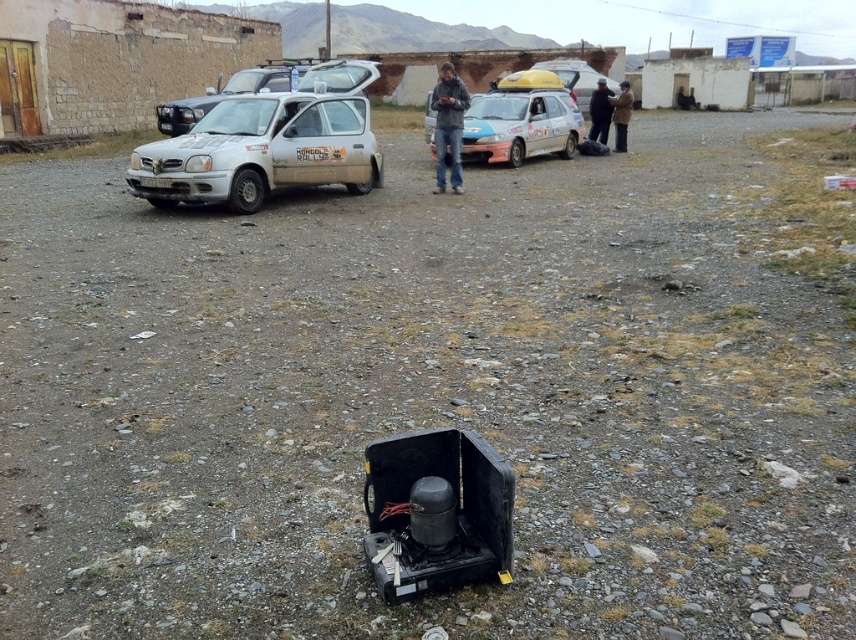
Is gray matte jacket at center bigger than brown leather jacket at upper center?

Correct, gray matte jacket at center is larger in size than brown leather jacket at upper center.

Measure the distance between gray matte jacket at center and camera.

gray matte jacket at center is 23.02 feet from camera.

Who is more forward, (453, 177) or (608, 100)?

Positioned in front is point (453, 177).

This screenshot has height=640, width=856. Find the location of `gray matte jacket at center`. gray matte jacket at center is located at coordinates (449, 125).

Is white matte hatchback at center-left to the left of gray matte jacket at center from the viewer's perspective?

Yes, white matte hatchback at center-left is to the left of gray matte jacket at center.

Between white matte hatchback at center-left and gray matte jacket at center, which one is positioned higher?

Positioned higher is gray matte jacket at center.

Which is in front, point (287, 122) or point (438, 115)?

Point (287, 122)

Locate an element on the screen. The width and height of the screenshot is (856, 640). white matte hatchback at center-left is located at coordinates (260, 150).

Which is below, dark blue fabric jacket at upper center or brown leather jacket at upper center?

brown leather jacket at upper center is lower down.

From the picture: Can you confirm if dark blue fabric jacket at upper center is positioned to the right of brown leather jacket at upper center?

Incorrect, dark blue fabric jacket at upper center is not on the right side of brown leather jacket at upper center.

Where is `dark blue fabric jacket at upper center`? The height and width of the screenshot is (640, 856). dark blue fabric jacket at upper center is located at coordinates (599, 112).

Where is `dark blue fabric jacket at upper center`? dark blue fabric jacket at upper center is located at coordinates (599, 112).